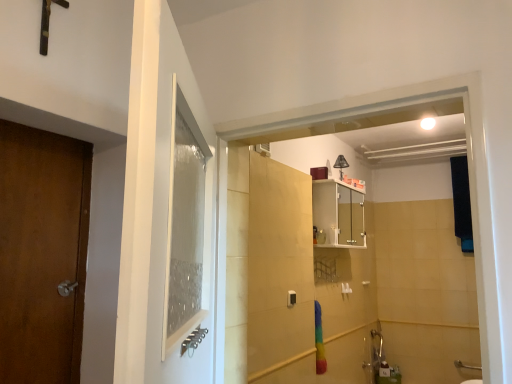
Question: Is white glossy cabinet at upper center taller or shorter than matte black lampshade at upper center?

Choices:
 (A) short
 (B) tall

Answer: (B)

Question: Choose the correct answer: Is white glossy cabinet at upper center inside matte black lampshade at upper center or outside it?

Choices:
 (A) inside
 (B) outside

Answer: (B)

Question: In the image, is white glossy cabinet at upper center positioned in front of or behind matte black lampshade at upper center?

Choices:
 (A) behind
 (B) front

Answer: (B)

Question: Visually, is matte black lampshade at upper center positioned to the left or to the right of white glossy cabinet at upper center?

Choices:
 (A) left
 (B) right

Answer: (B)

Question: Is matte black lampshade at upper center bigger or smaller than white glossy cabinet at upper center?

Choices:
 (A) big
 (B) small

Answer: (B)

Question: From the image's perspective, is matte black lampshade at upper center above or below white glossy cabinet at upper center?

Choices:
 (A) below
 (B) above

Answer: (B)

Question: Looking at their shapes, would you say matte black lampshade at upper center is wider or thinner than white glossy cabinet at upper center?

Choices:
 (A) wide
 (B) thin

Answer: (B)